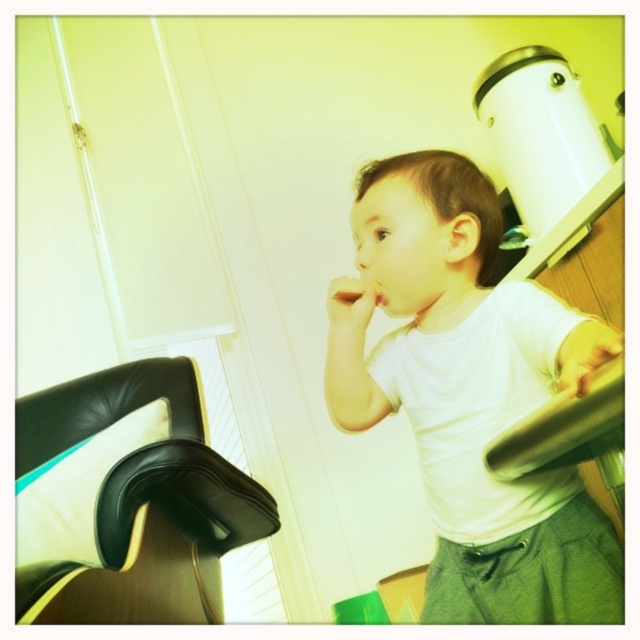
Who is taller, white matte shirt at upper right or black leather chair at lower left?

white matte shirt at upper right is taller.

Between point (456, 419) and point (170, 588), which one is positioned in front?

Positioned in front is point (456, 419).

Is point (472, 369) positioned behind point (214, 502)?

No, it is in front of (214, 502).

Locate an element on the screen. white matte shirt at upper right is located at coordinates (470, 394).